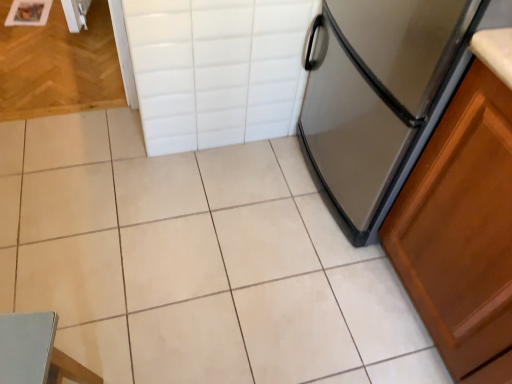
Locate an element on the screen. free area in between light blue fabric chair at lower left and white tile drawer at upper center is located at coordinates (173, 232).